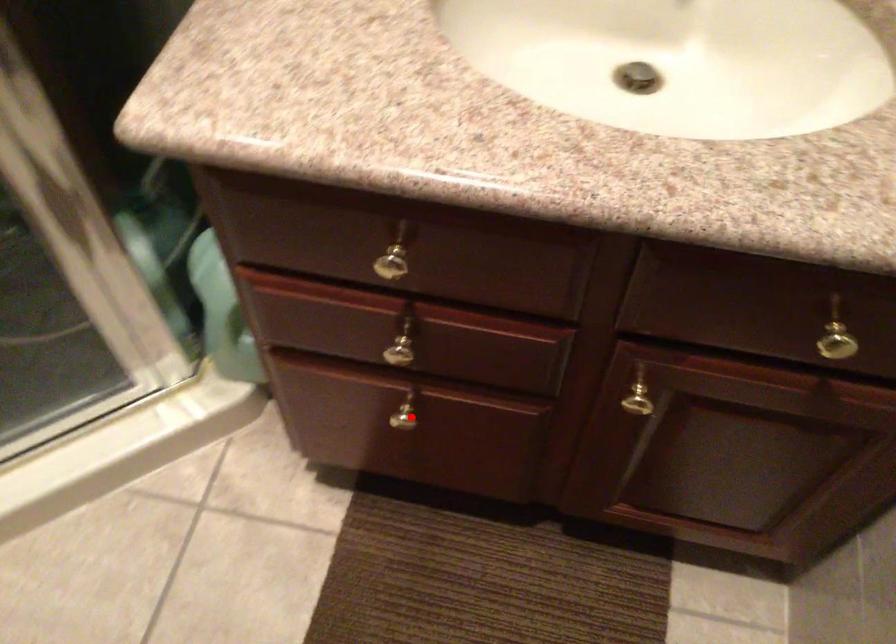
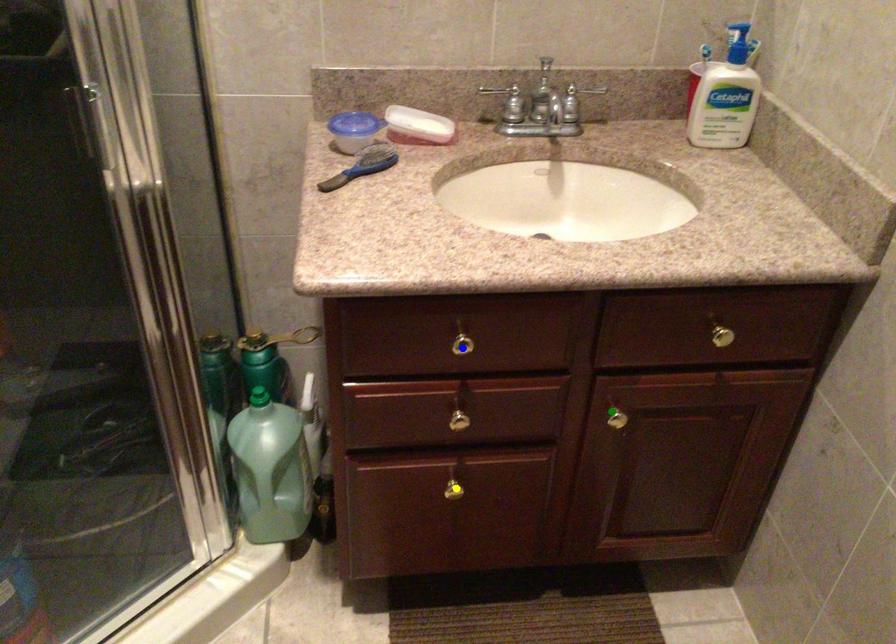
Question: I am providing you with two images of the same scene from different viewpoints. A red point is marked on the first image. You are given multiple points on the second image. Which spot in image 2 lines up with the point in image 1?

Choices:
 (A) blue point
 (B) green point
 (C) yellow point

Answer: (C)